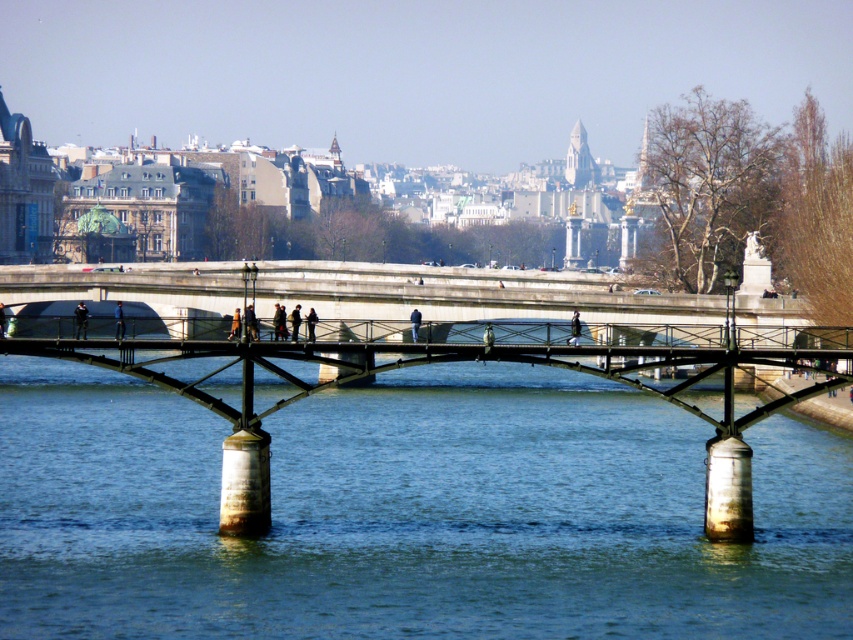
You are a photographer standing on the Passerelle L, wanting to capture a photo of the dark blue jeans at center and the blue fabric pedestrian at center. Which object should you focus on first if you want to ensure both are in sharp focus?

The dark blue jeans at center is positioned under the blue fabric pedestrian at center, so you should focus on the blue fabric pedestrian at center first to ensure both are in sharp focus.

You are a photographer standing on the Passerelle L, and you want to take a photo of the dark blue jeans at center and the blue fabric pedestrian at center. Which of the two objects should you focus on first if you want to capture both in a single shot without moving the camera?

The dark blue jeans at center is shorter than the blue fabric pedestrian at center, so you should focus on the blue fabric pedestrian at center first to ensure both are in focus.